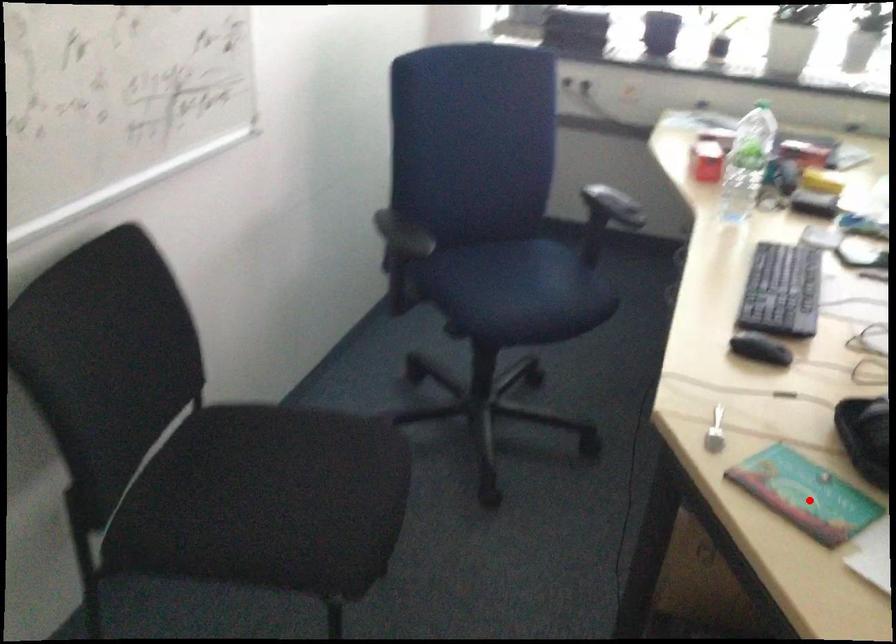
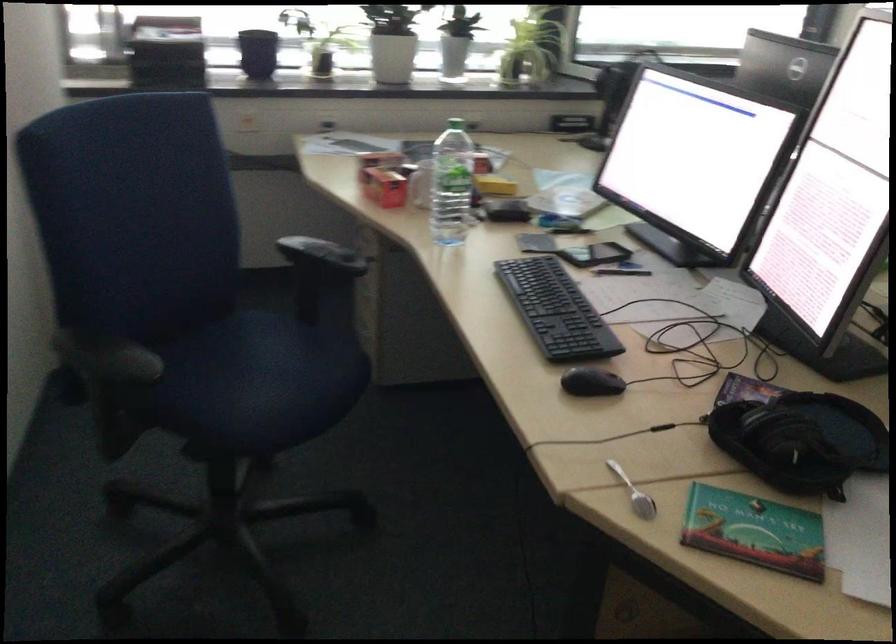
Where in the second image is the point corresponding to the highlighted location from the first image?

(754, 531)